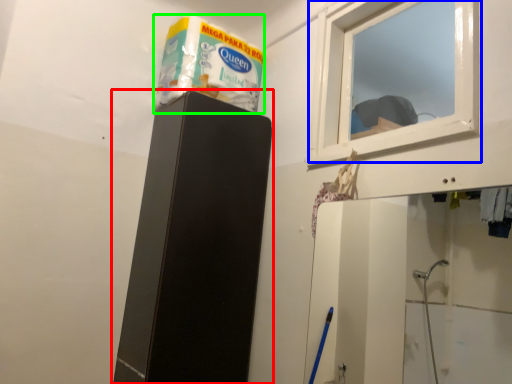
Question: Which object is the farthest from furniture (highlighted by a red box)? Choose among these: window (highlighted by a blue box) or product (highlighted by a green box).

Choices:
 (A) window
 (B) product

Answer: (A)